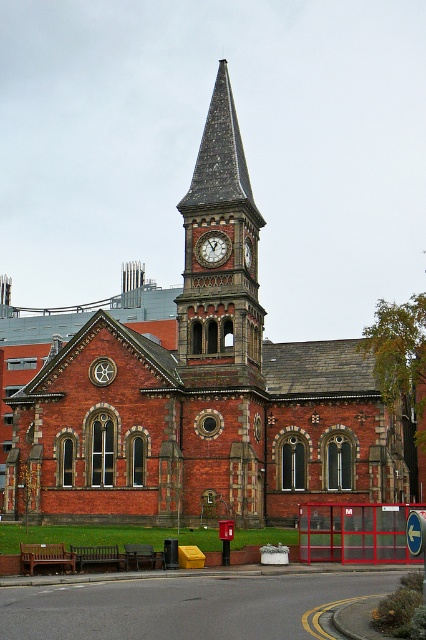
Question: From the image, what is the correct spatial relationship of red brick church at center in relation to matte red clock at center?

Choices:
 (A) above
 (B) below

Answer: (A)

Question: Which of the following is the closest to the observer?

Choices:
 (A) pyautogui.click(x=204, y=241)
 (B) pyautogui.click(x=147, y=371)

Answer: (B)

Question: Can you confirm if red brick church at center is positioned above matte brown clock at center?

Choices:
 (A) no
 (B) yes

Answer: (B)

Question: Estimate the real-world distances between objects in this image. Which object is farther from the dark brown stone clock tower at center?

Choices:
 (A) red brick church at center
 (B) matte red clock at center
 (C) matte brown clock at center

Answer: (A)

Question: Considering the relative positions of matte red clock at center and matte brown clock at center in the image provided, where is matte red clock at center located with respect to matte brown clock at center?

Choices:
 (A) below
 (B) above

Answer: (B)

Question: Which point is closer to the camera taking this photo?

Choices:
 (A) (204, 244)
 (B) (204, 182)

Answer: (A)